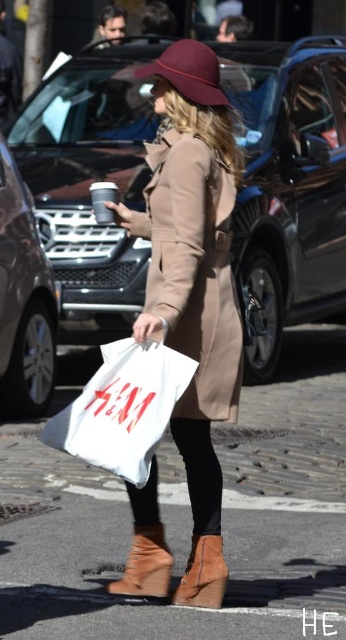
Question: Based on their relative distances, which object is nearer to the matte beige coat at center?

Choices:
 (A) white paper bag at lower center
 (B) tan leather trench coat at center
 (C) silver metallic car at left
 (D) shiny black car at center

Answer: (B)

Question: Does matte beige coat at center have a larger size compared to suede brown boot at lower center?

Choices:
 (A) no
 (B) yes

Answer: (B)

Question: Can you confirm if shiny black car at center is smaller than tan leather trench coat at center?

Choices:
 (A) no
 (B) yes

Answer: (B)

Question: Is the position of shiny black car at center more distant than that of suede brown boot at lower center?

Choices:
 (A) no
 (B) yes

Answer: (B)

Question: Which point appears farthest from the camera in this image?

Choices:
 (A) (214, 563)
 (B) (98, 102)
 (C) (204, 200)

Answer: (B)

Question: Which object is positioned farthest from the tan leather trench coat at center?

Choices:
 (A) silver metallic car at left
 (B) shiny black car at center
 (C) white paper bag at lower center

Answer: (A)